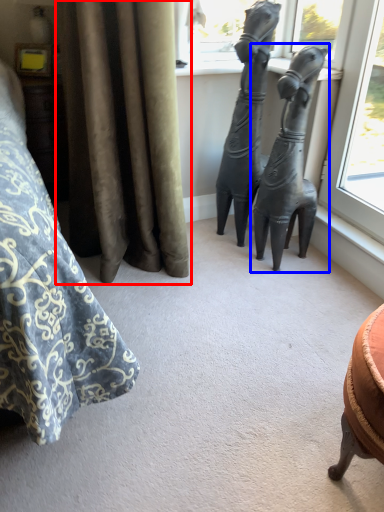
Question: Which object is closer to the camera taking this photo, curtain (highlighted by a red box) or statue (sculpture) (highlighted by a blue box)?

Choices:
 (A) curtain
 (B) statue (sculpture)

Answer: (A)